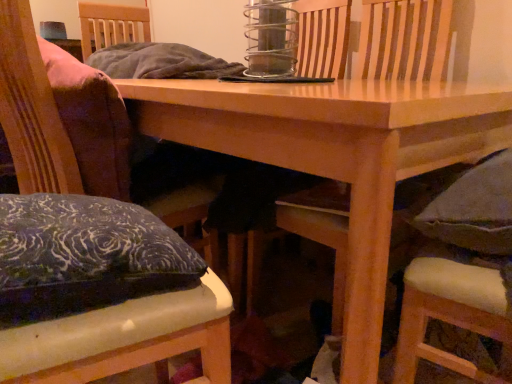
Question: From the image's perspective, is velvet cushioned armchair at center on top of dark gray cushioned chair at lower right, the 1th chair in the right-to-left sequence?

Choices:
 (A) yes
 (B) no

Answer: (A)

Question: Could you tell me if velvet cushioned armchair at center is facing dark gray cushioned chair at lower right, the 1th chair in the right-to-left sequence?

Choices:
 (A) no
 (B) yes

Answer: (A)

Question: Are velvet cushioned armchair at center and dark gray cushioned chair at lower right, positioned as the 3th chair in left-to-right order, beside each other?

Choices:
 (A) yes
 (B) no

Answer: (B)

Question: Can you confirm if velvet cushioned armchair at center is bigger than dark gray cushioned chair at lower right, the 1th chair in the right-to-left sequence?

Choices:
 (A) no
 (B) yes

Answer: (B)

Question: Would you consider velvet cushioned armchair at center to be distant from dark gray cushioned chair at lower right, the 1th chair in the right-to-left sequence?

Choices:
 (A) no
 (B) yes

Answer: (A)

Question: From the image's perspective, is velvet cushioned armchair at center under dark gray cushioned chair at lower right, the 1th chair in the right-to-left sequence?

Choices:
 (A) yes
 (B) no

Answer: (B)

Question: Are velvet cushion at left, the 2th chair positioned from the right, and wooden table at center far apart?

Choices:
 (A) yes
 (B) no

Answer: (B)

Question: From the image's perspective, is velvet cushion at left, the 2th chair positioned from the right, located beneath wooden table at center?

Choices:
 (A) yes
 (B) no

Answer: (A)

Question: Could you tell me if velvet cushion at left, the 2th chair positioned from the right, is turned towards wooden table at center?

Choices:
 (A) no
 (B) yes

Answer: (A)

Question: Is velvet cushion at left, which is counted as the second chair, starting from the left, with wooden table at center?

Choices:
 (A) no
 (B) yes

Answer: (A)

Question: Does velvet cushion at left, the 2th chair positioned from the right, lie in front of wooden table at center?

Choices:
 (A) yes
 (B) no

Answer: (B)

Question: From the image's perspective, is velvet cushion at left, which is counted as the second chair, starting from the left, over wooden table at center?

Choices:
 (A) yes
 (B) no

Answer: (B)

Question: Considering the relative sizes of velvet cushioned armchair at center and velvet cushion at left, the 2th chair positioned from the right, in the image provided, is velvet cushioned armchair at center taller than velvet cushion at left, the 2th chair positioned from the right,?

Choices:
 (A) yes
 (B) no

Answer: (A)